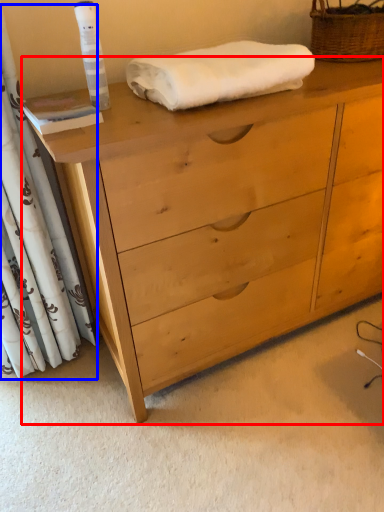
Question: Which object appears closest to the camera in this image, chest of drawers (highlighted by a red box) or curtain (highlighted by a blue box)?

Choices:
 (A) chest of drawers
 (B) curtain

Answer: (A)